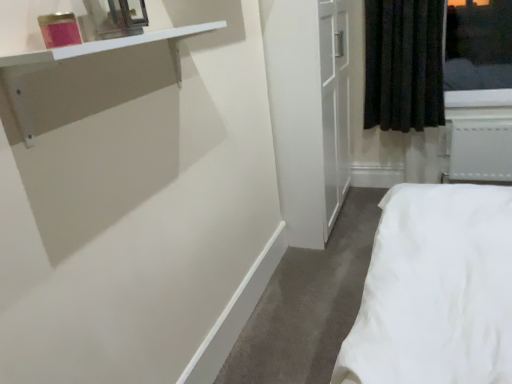
Where is `vacant region above white plastic radiator at lower right (from a real-world perspective)`? vacant region above white plastic radiator at lower right (from a real-world perspective) is located at coordinates (484, 112).